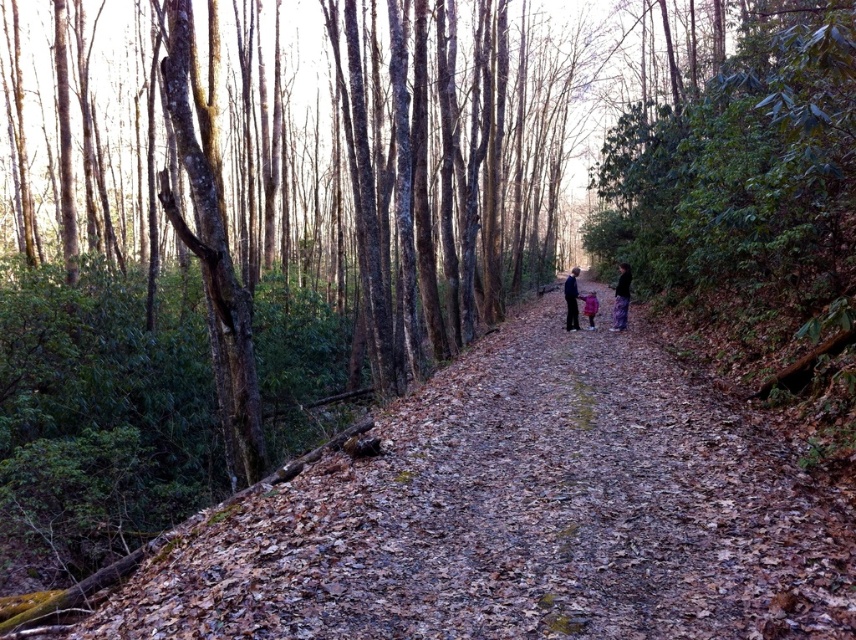
Can you confirm if brown leafy forest path at center is thinner than matte pink coat at center?

No, brown leafy forest path at center is not thinner than matte pink coat at center.

Who is lower down, brown leafy forest path at center or matte pink coat at center?

brown leafy forest path at center

Is point (518, 417) more distant than point (622, 273)?

No, (518, 417) is in front of (622, 273).

Locate an element on the screen. The image size is (856, 640). brown leafy forest path at center is located at coordinates (519, 515).

Does point (629, 278) lie behind point (617, 316)?

No, it is in front of (617, 316).

Can you confirm if matte pink coat at center is shorter than floral skirt at center?

Incorrect, matte pink coat at center's height does not fall short of floral skirt at center's.

Does point (620, 326) lie behind point (622, 284)?

No, it is not.

Find the location of a particular element. The width and height of the screenshot is (856, 640). matte pink coat at center is located at coordinates (621, 298).

Can you confirm if matte pink coat at center is positioned to the right of pink fleece jacket at center?

Correct, you'll find matte pink coat at center to the right of pink fleece jacket at center.

Where is `matte pink coat at center`? matte pink coat at center is located at coordinates tap(621, 298).

This screenshot has width=856, height=640. Identify the location of matte pink coat at center. (621, 298).